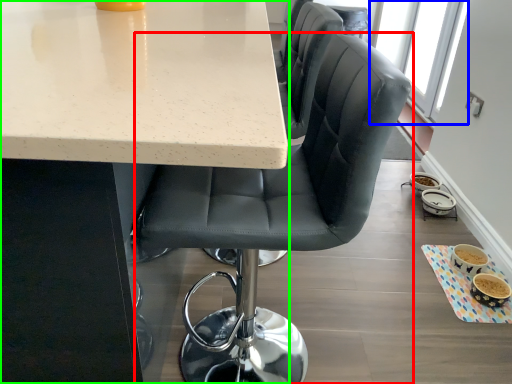
Question: Which object is the farthest from chair (highlighted by a red box)? Choose among these: window screen (highlighted by a blue box) or table (highlighted by a green box).

Choices:
 (A) window screen
 (B) table

Answer: (A)